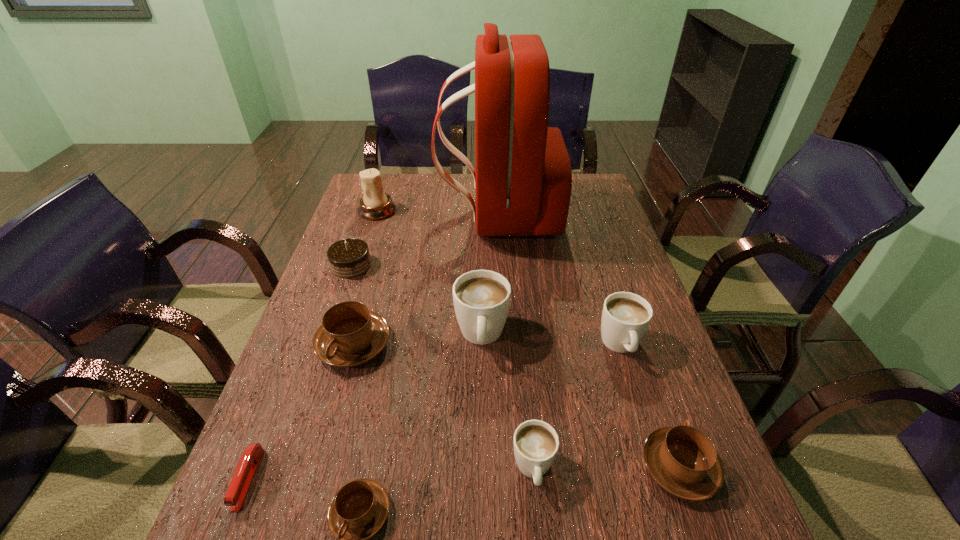
The width and height of the screenshot is (960, 540). What are the coordinates of `pink backpack` in the screenshot? It's located at (523, 180).

This screenshot has width=960, height=540. I want to click on backpack, so click(x=523, y=180).

The height and width of the screenshot is (540, 960). In order to click on white candle holder in this screenshot , I will do `click(375, 204)`.

Locate an element on the screen. The height and width of the screenshot is (540, 960). the tallest cappuccino is located at coordinates (481, 298).

Where is `the eighth shortest object`? the eighth shortest object is located at coordinates (481, 298).

Where is `the second smallest white cappuccino`? This screenshot has height=540, width=960. the second smallest white cappuccino is located at coordinates (626, 316).

Locate an element on the screen. the rightmost white cappuccino is located at coordinates (626, 316).

Locate an element on the screen. chocolate chocolate cake is located at coordinates (348, 258).

Locate an element on the screen. This screenshot has height=540, width=960. the farthest brown cappuccino is located at coordinates (350, 335).

The height and width of the screenshot is (540, 960). What are the coordinates of `the nearest white cappuccino` in the screenshot? It's located at (536, 443).